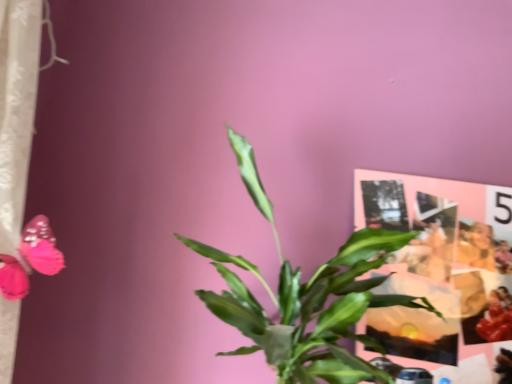
The image size is (512, 384). Find the location of `matte paper collage at upper right`. matte paper collage at upper right is located at coordinates (442, 272).

Image resolution: width=512 pixels, height=384 pixels. Find the location of `green leafy plant at center`. green leafy plant at center is located at coordinates 306,298.

Where is `matte paper collage at upper right`? matte paper collage at upper right is located at coordinates (442, 272).

From a real-world perspective, is matte paper collage at upper right below smooth beige jacket at upper right?

Yes, from a real-world perspective, matte paper collage at upper right is under smooth beige jacket at upper right.

Is matte paper collage at upper right far from smooth beige jacket at upper right?

No, there isn't a large distance between matte paper collage at upper right and smooth beige jacket at upper right.

Would you say matte paper collage at upper right is inside or outside smooth beige jacket at upper right?

matte paper collage at upper right is not enclosed by smooth beige jacket at upper right.

Measure the distance between matte paper collage at upper right and smooth beige jacket at upper right.

A distance of 4.26 inches exists between matte paper collage at upper right and smooth beige jacket at upper right.

How much distance is there between smooth beige jacket at upper right and green leafy plant at center?

A distance of 16.35 inches exists between smooth beige jacket at upper right and green leafy plant at center.

In the scene shown: Is smooth beige jacket at upper right bigger or smaller than green leafy plant at center?

In the image, smooth beige jacket at upper right appears to be smaller than green leafy plant at center.

Is smooth beige jacket at upper right further to the viewer compared to green leafy plant at center?

Yes, smooth beige jacket at upper right is further from the viewer.

From the image's perspective, is smooth beige jacket at upper right over green leafy plant at center?

No.

Which object is closer to the camera, green leafy plant at center or smooth beige jacket at upper right?

Positioned in front is green leafy plant at center.

Would you say smooth beige jacket at upper right is part of green leafy plant at center's contents?

No, smooth beige jacket at upper right is not a part of green leafy plant at center.

Does green leafy plant at center appear on the left side of smooth beige jacket at upper right?

Yes, green leafy plant at center is to the left of smooth beige jacket at upper right.

Is smooth beige jacket at upper right located outside matte paper collage at upper right?

No, most part of smooth beige jacket at upper right lies within matte paper collage at upper right.

Considering the sizes of objects smooth beige jacket at upper right and matte paper collage at upper right in the image provided, who is thinner, smooth beige jacket at upper right or matte paper collage at upper right?

matte paper collage at upper right.

Can you confirm if smooth beige jacket at upper right is bigger than matte paper collage at upper right?

No, smooth beige jacket at upper right is not bigger than matte paper collage at upper right.

Is matte paper collage at upper right further to the viewer compared to green leafy plant at center?

That is True.

Who is smaller, matte paper collage at upper right or green leafy plant at center?

matte paper collage at upper right is smaller.

Which of these two, matte paper collage at upper right or green leafy plant at center, stands taller?

matte paper collage at upper right.

Considering the sizes of objects matte paper collage at upper right and green leafy plant at center in the image provided, who is wider, matte paper collage at upper right or green leafy plant at center?

green leafy plant at center is wider.

From the picture: Is green leafy plant at center positioned behind matte paper collage at upper right?

No, the depth of green leafy plant at center is less than that of matte paper collage at upper right.

Measure the distance between green leafy plant at center and matte paper collage at upper right.

green leafy plant at center and matte paper collage at upper right are 7.15 inches apart.

Is green leafy plant at center not close to matte paper collage at upper right?

Actually, green leafy plant at center and matte paper collage at upper right are a little close together.

What's the angular difference between green leafy plant at center and matte paper collage at upper right's facing directions?

They differ by 0.755 degrees in their facing directions.

The width and height of the screenshot is (512, 384). Find the location of `person above the matte paper collage at upper right (from a real-world perspective)`. person above the matte paper collage at upper right (from a real-world perspective) is located at coordinates (476, 245).

In order to click on person below the green leafy plant at center (from the image's perspective) in this screenshot , I will do `click(476, 245)`.

From the picture: Looking at the image, which one is located further to matte paper collage at upper right, smooth beige jacket at upper right or green leafy plant at center?

The object further to matte paper collage at upper right is green leafy plant at center.

When comparing their distances from green leafy plant at center, does matte paper collage at upper right or smooth beige jacket at upper right seem further?

smooth beige jacket at upper right is positioned further to the anchor green leafy plant at center.

Which object lies nearer to the anchor point matte paper collage at upper right, green leafy plant at center or smooth beige jacket at upper right?

The object closer to matte paper collage at upper right is smooth beige jacket at upper right.

Considering their positions, is smooth beige jacket at upper right positioned closer to green leafy plant at center than matte paper collage at upper right?

matte paper collage at upper right.

From the image, which object appears to be nearer to smooth beige jacket at upper right, green leafy plant at center or matte paper collage at upper right?

The object closer to smooth beige jacket at upper right is matte paper collage at upper right.

Estimate the real-world distances between objects in this image. Which object is further from smooth beige jacket at upper right, matte paper collage at upper right or green leafy plant at center?

Based on the image, green leafy plant at center appears to be further to smooth beige jacket at upper right.

Where is `postcard located between green leafy plant at center and smooth beige jacket at upper right in the depth direction`? The image size is (512, 384). postcard located between green leafy plant at center and smooth beige jacket at upper right in the depth direction is located at coordinates (442, 272).